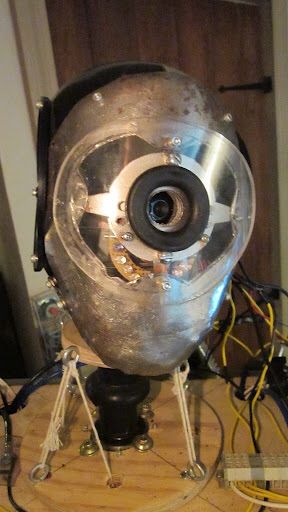
Find the location of a particular element. The width and height of the screenshot is (288, 512). hook on base is located at coordinates (201, 469).